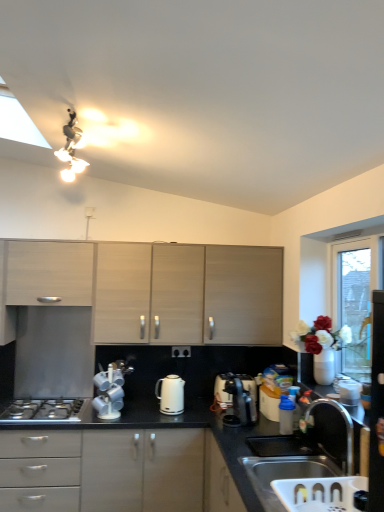
Identify the location of vacant space to the right of white plastic coffee machine at center, placed as the 1th coffee machine when sorted from left to right. Image resolution: width=384 pixels, height=512 pixels. (134, 416).